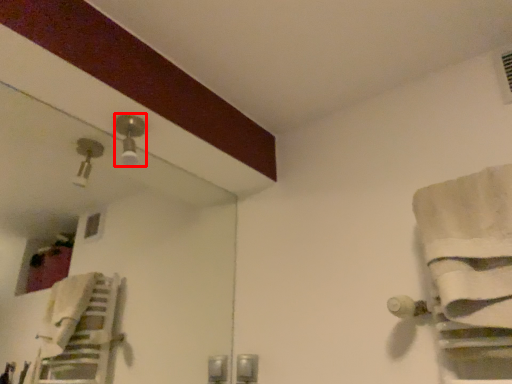
Question: From the image, what is the correct spatial relationship of light fixture (annotated by the red box) in relation to bath towel?

Choices:
 (A) left
 (B) right

Answer: (A)